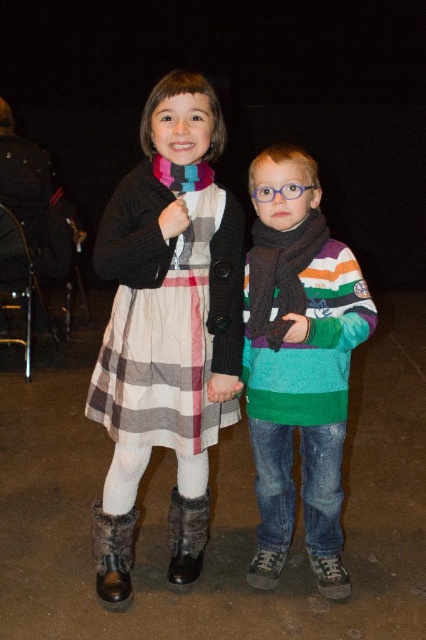
Looking at this image, you are a photographer setting up for a nighttime portrait. You need to ensure both the plaid cotton dress at center and the brown woolen scarf at center are clearly visible in the frame. Based on their positions, which item should you focus on first to ensure proper lighting?

The plaid cotton dress at center is positioned under the brown woolen scarf at center. To ensure both are visible, focus on the brown woolen scarf at center first since it is higher and might be in a better lit area, then adjust lighting for the dress below.

You are a photographer trying to capture a close shot of the children without making them move. Your camera can only focus on objects within a 30 inch range. Given the distance between the brown woolen scarf at center and the furry black boot at lower left, will you be able to focus on both in the same shot?

The distance between the brown woolen scarf at center and the furry black boot at lower left is 36.21 inches, which exceeds the camera focus range of 30 inches. Therefore, you cannot focus on both in the same shot.

Based on the scene description, where is the brown woolen scarf at center located in terms of coordinates?

The brown woolen scarf at center is located at point coordinates of (281, 275).